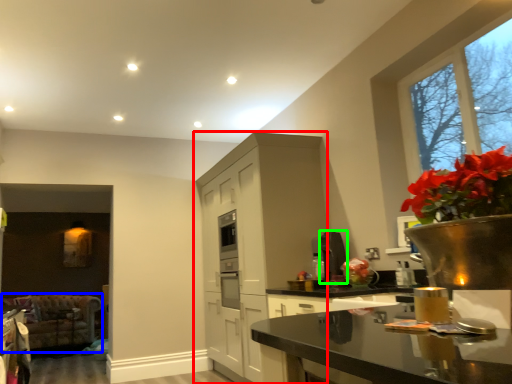
Question: Which object is the farthest from cabinetry (highlighted by a red box)? Choose among these: armchair (highlighted by a blue box) or appliance (highlighted by a green box).

Choices:
 (A) armchair
 (B) appliance

Answer: (A)